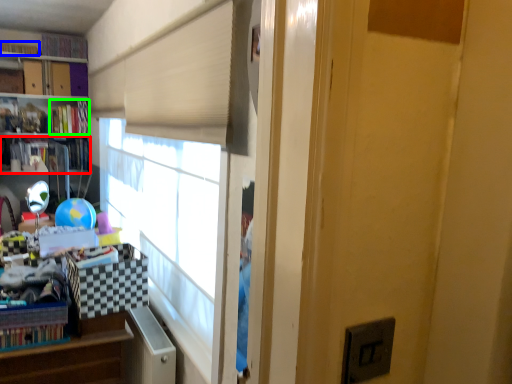
Question: Estimate the real-world distances between objects in this image. Which object is farther from book (highlighted by a red box), book (highlighted by a blue box) or book (highlighted by a green box)?

Choices:
 (A) book
 (B) book

Answer: (A)